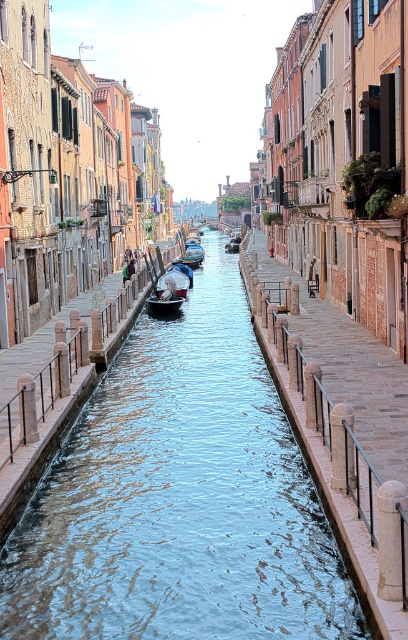
Question: Does clear blue water at center appear on the right side of white glossy boat at center?

Choices:
 (A) yes
 (B) no

Answer: (A)

Question: Among these objects, which one is farthest from the camera?

Choices:
 (A) clear blue water at center
 (B) white glossy boat at center
 (C) wooden gondola at center

Answer: (C)

Question: Which point appears farthest from the camera in this image?

Choices:
 (A) pyautogui.click(x=188, y=244)
 (B) pyautogui.click(x=51, y=570)

Answer: (A)

Question: Can you confirm if clear blue water at center is positioned to the left of wooden gondola at center?

Choices:
 (A) no
 (B) yes

Answer: (A)

Question: Is white glossy boat at center to the left of wooden gondola at center from the viewer's perspective?

Choices:
 (A) no
 (B) yes

Answer: (B)

Question: Which of the following is the farthest from the observer?

Choices:
 (A) coord(181,260)
 (B) coord(255,580)
 (C) coord(173,296)

Answer: (A)